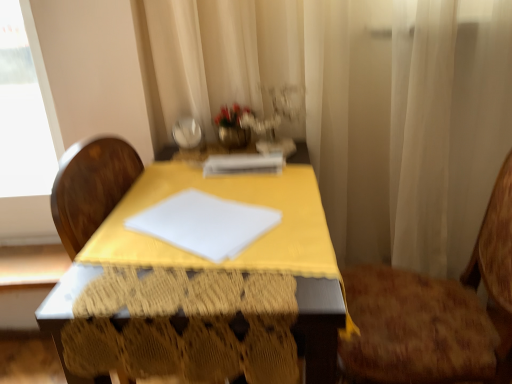
Question: Can you confirm if brown textured chair at right is positioned to the right of white sheer curtain at center?

Choices:
 (A) no
 (B) yes

Answer: (B)

Question: Can you confirm if brown textured chair at right is taller than white sheer curtain at center?

Choices:
 (A) yes
 (B) no

Answer: (B)

Question: From a real-world perspective, is brown textured chair at right positioned over white sheer curtain at center based on gravity?

Choices:
 (A) no
 (B) yes

Answer: (A)

Question: Is brown textured chair at right oriented away from white sheer curtain at center?

Choices:
 (A) no
 (B) yes

Answer: (A)

Question: Is brown textured chair at right positioned behind white sheer curtain at center?

Choices:
 (A) yes
 (B) no

Answer: (B)

Question: Is brown textured chair at right in contact with white sheer curtain at center?

Choices:
 (A) no
 (B) yes

Answer: (A)

Question: From a real-world perspective, is white sheer curtain at center physically above white paper at center?

Choices:
 (A) no
 (B) yes

Answer: (A)

Question: Considering the relative positions of white sheer curtain at center and white paper at center in the image provided, is white sheer curtain at center behind white paper at center?

Choices:
 (A) yes
 (B) no

Answer: (B)

Question: Are white sheer curtain at center and white paper at center far apart?

Choices:
 (A) yes
 (B) no

Answer: (B)

Question: From the image's perspective, would you say white sheer curtain at center is positioned over white paper at center?

Choices:
 (A) yes
 (B) no

Answer: (B)

Question: Can you confirm if white sheer curtain at center is smaller than white paper at center?

Choices:
 (A) yes
 (B) no

Answer: (B)

Question: From the image's perspective, is white sheer curtain at center beneath white paper at center?

Choices:
 (A) yes
 (B) no

Answer: (A)

Question: Does white paper at center have a lesser width compared to yellow fabric-covered table at center?

Choices:
 (A) yes
 (B) no

Answer: (A)